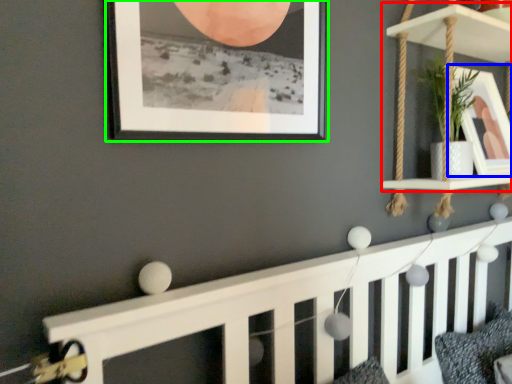
Question: Which is farther away from shelf (highlighted by a red box)? picture frame (highlighted by a blue box) or picture frame (highlighted by a green box)?

Choices:
 (A) picture frame
 (B) picture frame

Answer: (B)